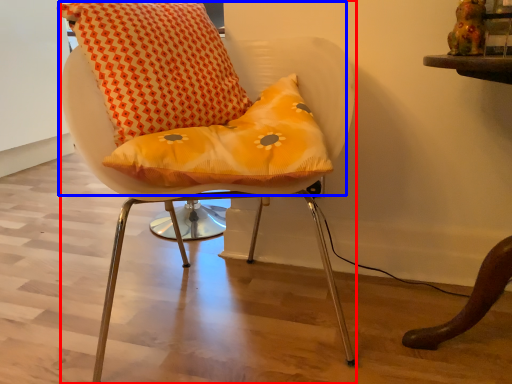
Question: Which object is further to the camera taking this photo, chair (highlighted by a red box) or bean bag chair (highlighted by a blue box)?

Choices:
 (A) chair
 (B) bean bag chair

Answer: (B)